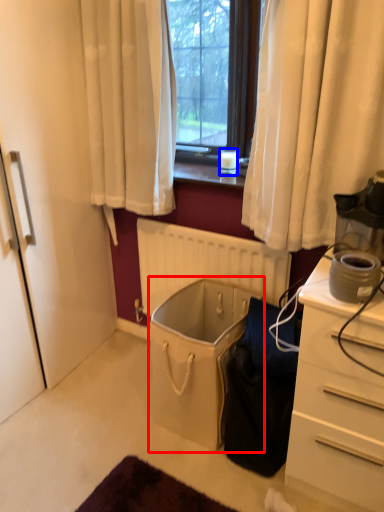
Question: Which point is closer to the camera, laundry basket (highlighted by a red box) or coffee cup (highlighted by a blue box)?

Choices:
 (A) laundry basket
 (B) coffee cup

Answer: (A)